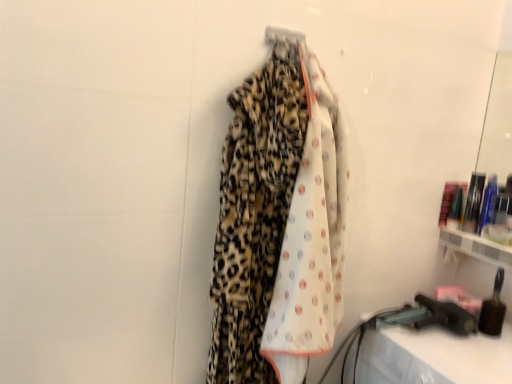
The height and width of the screenshot is (384, 512). I want to click on translucent plastic bottles at right, the second toiletry positioned from the bottom, so click(x=473, y=202).

Locate an element on the screen. brown bristle brush at lower right, the second toiletry when ordered from back to front is located at coordinates (493, 309).

The height and width of the screenshot is (384, 512). Describe the element at coordinates (279, 221) in the screenshot. I see `leopard print fabric at center` at that location.

I want to click on translucent plastic bottles at right, the second toiletry viewed from the front, so click(473, 202).

Locate an element on the screen. The image size is (512, 384). curtain that is under the metallic silver hanger at upper center (from a real-world perspective) is located at coordinates (279, 221).

Is leopard print fabric at center turned away from metallic silver hanger at upper center?

Yes, leopard print fabric at center is facing away from metallic silver hanger at upper center.

Is leopard print fabric at center outside of metallic silver hanger at upper center?

Yes.

Relative to leopard print fabric at center, is translucent plastic bottles at right, the second toiletry viewed from the front, in front or behind?

In the image, translucent plastic bottles at right, the second toiletry viewed from the front, appears behind leopard print fabric at center.

What's the angular difference between translucent plastic bottles at right, the first toiletry from the top, and leopard print fabric at center's facing directions?

The angle between the facing direction of translucent plastic bottles at right, the first toiletry from the top, and the facing direction of leopard print fabric at center is 80.9 degrees.

Considering the relative sizes of translucent plastic bottles at right, the 1th toiletry viewed from the back, and leopard print fabric at center in the image provided, is translucent plastic bottles at right, the 1th toiletry viewed from the back, shorter than leopard print fabric at center?

Yes.

From the image's perspective, between translucent plastic bottles at right, the second toiletry positioned from the bottom, and leopard print fabric at center, which one is located above?

translucent plastic bottles at right, the second toiletry positioned from the bottom, is shown above in the image.

From the image's perspective, is brown bristle brush at lower right, the second toiletry when ordered from back to front, positioned above or below metallic silver hanger at upper center?

brown bristle brush at lower right, the second toiletry when ordered from back to front, is below metallic silver hanger at upper center.

Which is in front, point (482, 321) or point (283, 29)?

The point (283, 29) is closer.

Are brown bristle brush at lower right, the second toiletry when ordered from back to front, and metallic silver hanger at upper center beside each other?

No.

Considering the relative sizes of brown bristle brush at lower right, the second toiletry when ordered from back to front, and metallic silver hanger at upper center in the image provided, is brown bristle brush at lower right, the second toiletry when ordered from back to front, shorter than metallic silver hanger at upper center?

No, brown bristle brush at lower right, the second toiletry when ordered from back to front, is not shorter than metallic silver hanger at upper center.

Visually, is translucent plastic bottles at right, the second toiletry viewed from the front, positioned to the left or to the right of brown bristle brush at lower right, placed as the second toiletry when sorted from top to bottom?

From the image, it's evident that translucent plastic bottles at right, the second toiletry viewed from the front, is to the right of brown bristle brush at lower right, placed as the second toiletry when sorted from top to bottom.

Between translucent plastic bottles at right, the second toiletry positioned from the bottom, and brown bristle brush at lower right, acting as the first toiletry starting from the front, which one has larger size?

brown bristle brush at lower right, acting as the first toiletry starting from the front.

Is translucent plastic bottles at right, the first toiletry from the top, looking in the opposite direction of brown bristle brush at lower right, acting as the first toiletry starting from the front?

No, translucent plastic bottles at right, the first toiletry from the top, is not facing away from brown bristle brush at lower right, acting as the first toiletry starting from the front.

How far apart are leopard print fabric at center and translucent plastic bottles at right, the second toiletry positioned from the bottom?

leopard print fabric at center and translucent plastic bottles at right, the second toiletry positioned from the bottom, are 32.97 inches apart from each other.

Which of these two, leopard print fabric at center or translucent plastic bottles at right, the 1th toiletry viewed from the back, stands taller?

leopard print fabric at center is taller.

Can you see leopard print fabric at center touching translucent plastic bottles at right, the second toiletry viewed from the front?

No, leopard print fabric at center is not touching translucent plastic bottles at right, the second toiletry viewed from the front.

Which object is further away from the camera taking this photo, leopard print fabric at center or translucent plastic bottles at right, the 1th toiletry viewed from the back?

Positioned behind is translucent plastic bottles at right, the 1th toiletry viewed from the back.

Is metallic silver hanger at upper center at the left side of brown bristle brush at lower right, acting as the 1th toiletry starting from the bottom?

Yes, metallic silver hanger at upper center is to the left of brown bristle brush at lower right, acting as the 1th toiletry starting from the bottom.

From a real-world perspective, which object rests below the other?

brown bristle brush at lower right, the second toiletry when ordered from back to front, is physically lower.

Image resolution: width=512 pixels, height=384 pixels. Identify the location of the 2nd toiletry below when counting from the metallic silver hanger at upper center (from the image's perspective). (493, 309).

From a real-world perspective, is translucent plastic bottles at right, the 1th toiletry viewed from the back, positioned under metallic silver hanger at upper center based on gravity?

Yes.

Measure the distance between translucent plastic bottles at right, the 1th toiletry viewed from the back, and metallic silver hanger at upper center.

90.90 centimeters.

Where is `hanger above the translucent plastic bottles at right, the 1th toiletry viewed from the back (from a real-world perspective)`? This screenshot has height=384, width=512. hanger above the translucent plastic bottles at right, the 1th toiletry viewed from the back (from a real-world perspective) is located at coordinates (283, 35).

Is translucent plastic bottles at right, the second toiletry viewed from the front, spatially inside metallic silver hanger at upper center, or outside of it?

translucent plastic bottles at right, the second toiletry viewed from the front, exists outside the volume of metallic silver hanger at upper center.

Where is `hanger that is on the right side of leopard print fabric at center`? This screenshot has width=512, height=384. hanger that is on the right side of leopard print fabric at center is located at coordinates (283, 35).

Locate an element on the screen. curtain in front of the translucent plastic bottles at right, the second toiletry positioned from the bottom is located at coordinates (279, 221).

When comparing their distances from brown bristle brush at lower right, acting as the first toiletry starting from the front, does translucent plastic bottles at right, the second toiletry viewed from the front, or leopard print fabric at center seem closer?

translucent plastic bottles at right, the second toiletry viewed from the front, is positioned closer to the anchor brown bristle brush at lower right, acting as the first toiletry starting from the front.

From the image, which object appears to be farther from translucent plastic bottles at right, the 1th toiletry viewed from the back, brown bristle brush at lower right, acting as the 1th toiletry starting from the bottom, or metallic silver hanger at upper center?

metallic silver hanger at upper center lies further to translucent plastic bottles at right, the 1th toiletry viewed from the back, than the other object.

Looking at the image, which one is located further to translucent plastic bottles at right, the 1th toiletry viewed from the back, metallic silver hanger at upper center or brown bristle brush at lower right, placed as the second toiletry when sorted from top to bottom?

metallic silver hanger at upper center lies further to translucent plastic bottles at right, the 1th toiletry viewed from the back, than the other object.

From the image, which object appears to be nearer to translucent plastic bottles at right, the first toiletry from the top, leopard print fabric at center or brown bristle brush at lower right, placed as the second toiletry when sorted from top to bottom?

Among the two, brown bristle brush at lower right, placed as the second toiletry when sorted from top to bottom, is located nearer to translucent plastic bottles at right, the first toiletry from the top.

Consider the image. Based on their spatial positions, is metallic silver hanger at upper center or leopard print fabric at center further from translucent plastic bottles at right, the second toiletry viewed from the front?

Based on the image, metallic silver hanger at upper center appears to be further to translucent plastic bottles at right, the second toiletry viewed from the front.

Considering their positions, is leopard print fabric at center positioned closer to metallic silver hanger at upper center than translucent plastic bottles at right, the first toiletry from the top?

Based on the image, leopard print fabric at center appears to be nearer to metallic silver hanger at upper center.

Looking at the image, which one is located further to leopard print fabric at center, metallic silver hanger at upper center or translucent plastic bottles at right, the second toiletry positioned from the bottom?

translucent plastic bottles at right, the second toiletry positioned from the bottom.

Consider the image. Considering their positions, is translucent plastic bottles at right, the second toiletry viewed from the front, positioned further to metallic silver hanger at upper center than brown bristle brush at lower right, acting as the 1th toiletry starting from the bottom?

Based on the image, brown bristle brush at lower right, acting as the 1th toiletry starting from the bottom, appears to be further to metallic silver hanger at upper center.

You are a GUI agent. You are given a task and a screenshot of the screen. Output one action in this format:
    pyautogui.click(x=<x>, y=<y>)
    Task: Click on the curtain that lies between metallic silver hanger at upper center and brown bristle brush at lower right, acting as the 1th toiletry starting from the bottom, from top to bottom
    This screenshot has width=512, height=384.
    Given the screenshot: What is the action you would take?
    pyautogui.click(x=279, y=221)

Find the location of a particular element. hanger between leopard print fabric at center and translucent plastic bottles at right, the second toiletry positioned from the bottom is located at coordinates (x=283, y=35).

Identify the location of toiletry between leopard print fabric at center and translucent plastic bottles at right, the first toiletry from the top, in the horizontal direction. The width and height of the screenshot is (512, 384). (493, 309).

Where is `toiletry located between metallic silver hanger at upper center and translucent plastic bottles at right, the first toiletry from the top, in the left-right direction`? toiletry located between metallic silver hanger at upper center and translucent plastic bottles at right, the first toiletry from the top, in the left-right direction is located at coordinates (493, 309).